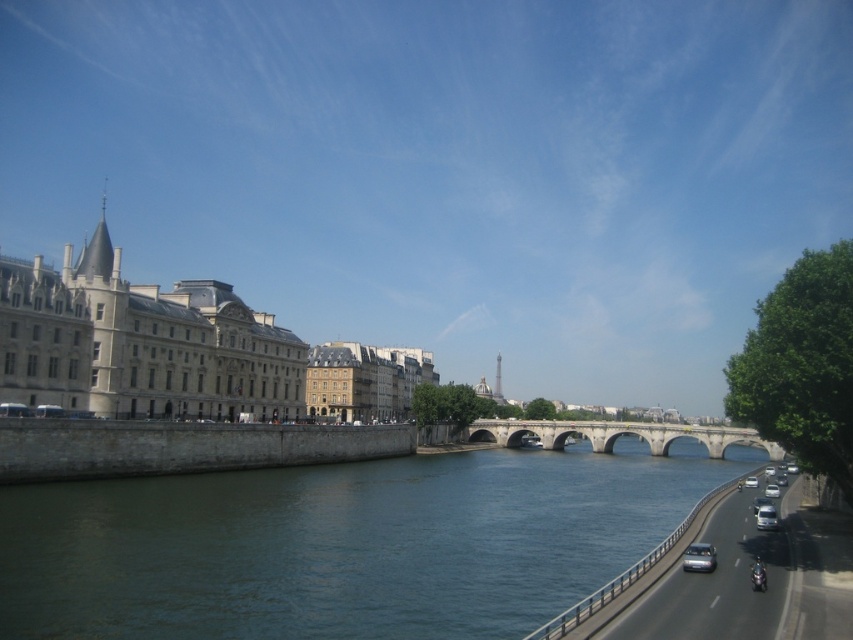
Question: Does stone arch bridge at center appear on the left side of satin silver car at right?

Choices:
 (A) no
 (B) yes

Answer: (A)

Question: Observing the image, what is the correct spatial positioning of greenish-blue water at center in reference to silver metallic van at right?

Choices:
 (A) below
 (B) above

Answer: (A)

Question: Which object is the closest to the satin silver car at right?

Choices:
 (A) greenish-blue water at center
 (B) silver metallic van at right

Answer: (B)

Question: Which object appears farthest from the camera in this image?

Choices:
 (A) satin silver car at right
 (B) greenish-blue water at center
 (C) silver metallic van at right
 (D) stone arch bridge at center

Answer: (D)

Question: Can you confirm if stone arch bridge at center is positioned to the right of satin silver car at right?

Choices:
 (A) no
 (B) yes

Answer: (B)

Question: Which point appears farthest from the camera in this image?

Choices:
 (A) (120, 500)
 (B) (483, 435)
 (C) (759, 520)
 (D) (683, 568)

Answer: (B)